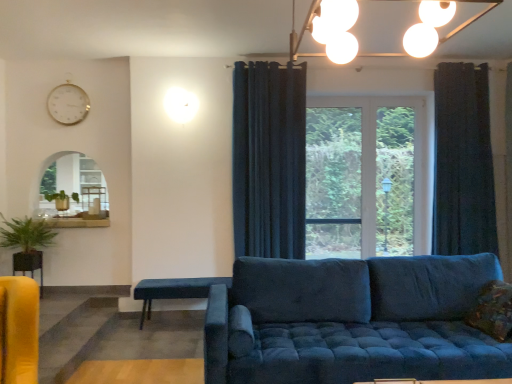
Find the location of a particular element. This screenshot has width=512, height=384. vacant space underneath white glossy clock at upper left (from a real-world perspective) is located at coordinates (69, 220).